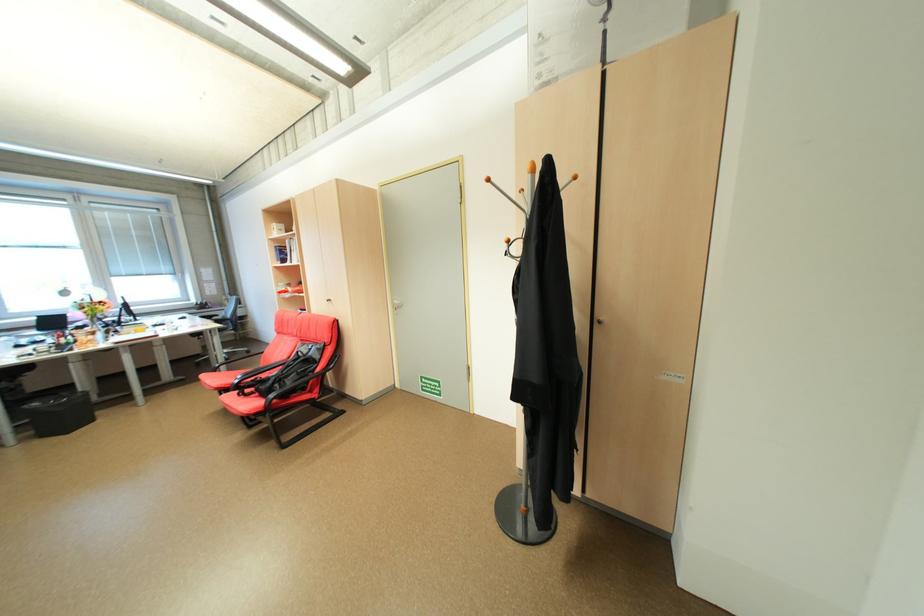
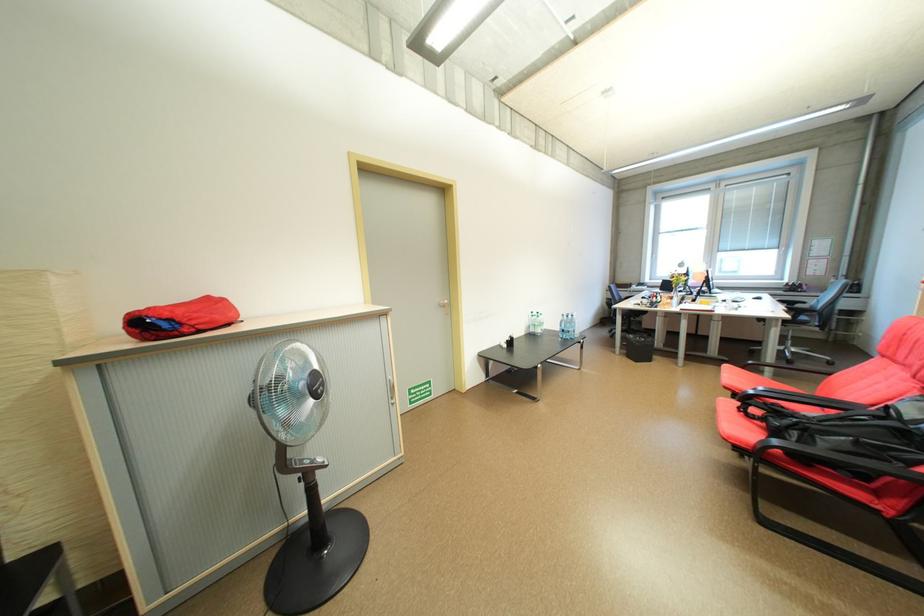
Locate, in the second image, the point that corresponds to (x=294, y=397) in the first image.

(809, 458)